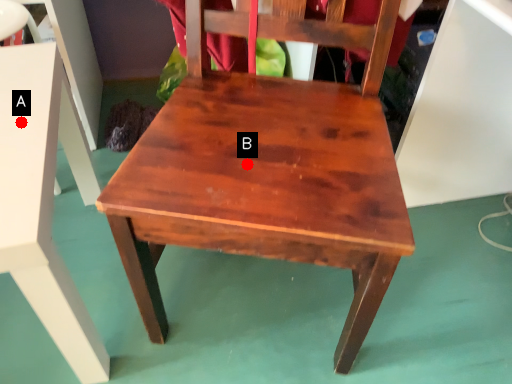
Question: Two points are circled on the image, labeled by A and B beside each circle. Which of the following is the closest to the observer?

Choices:
 (A) A is closer
 (B) B is closer

Answer: (B)